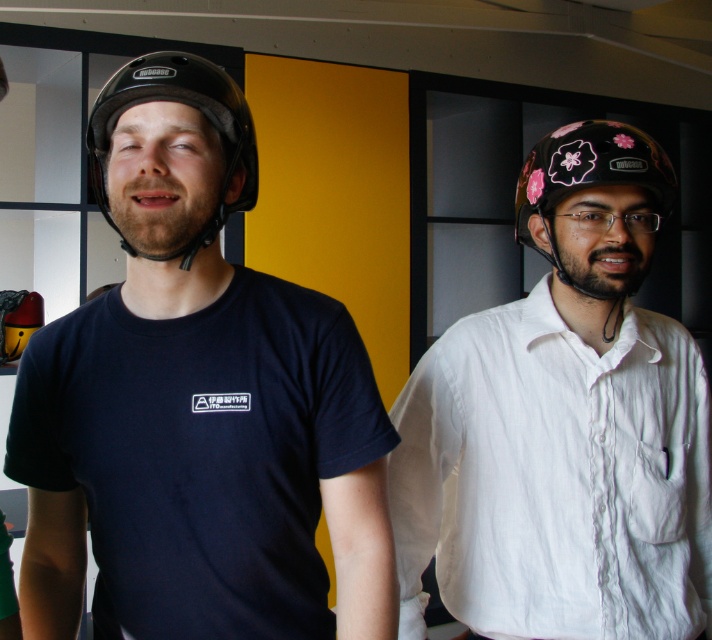
Between point (549, 243) and point (623, 221), which one is positioned behind?

The point (549, 243) is behind.

Who is lower down, white matte helmet at right or transparent plastic glasses at center?

white matte helmet at right

Who is more distant from viewer, (612,134) or (602,225)?

Positioned behind is point (602,225).

Identify the location of white matte helmet at right. The width and height of the screenshot is (712, 640). (562, 426).

Image resolution: width=712 pixels, height=640 pixels. What do you see at coordinates (187, 104) in the screenshot?
I see `black matte helmet at left` at bounding box center [187, 104].

Between black matte helmet at left and floral matte helmet at right, which one is positioned lower?

floral matte helmet at right is lower down.

Is point (135, 253) positioned after point (553, 140)?

No, it is in front of (553, 140).

At what (x,y) coordinates should I click in order to perform the action: click on black matte helmet at left. Please return your answer as a coordinate pair (x, y). Looking at the image, I should click on (187, 104).

Can you confirm if white matte helmet at right is positioned below floral matte helmet at right?

Yes, white matte helmet at right is below floral matte helmet at right.

Who is taller, white matte helmet at right or floral matte helmet at right?

white matte helmet at right

Is point (577, 492) in front of point (543, 184)?

Yes, point (577, 492) is closer to viewer.

You are a GUI agent. You are given a task and a screenshot of the screen. Output one action in this format:
    pyautogui.click(x=<x>, y=<y>)
    Task: Click on the white matte helmet at right
    The width and height of the screenshot is (712, 640).
    Given the screenshot: What is the action you would take?
    pyautogui.click(x=562, y=426)